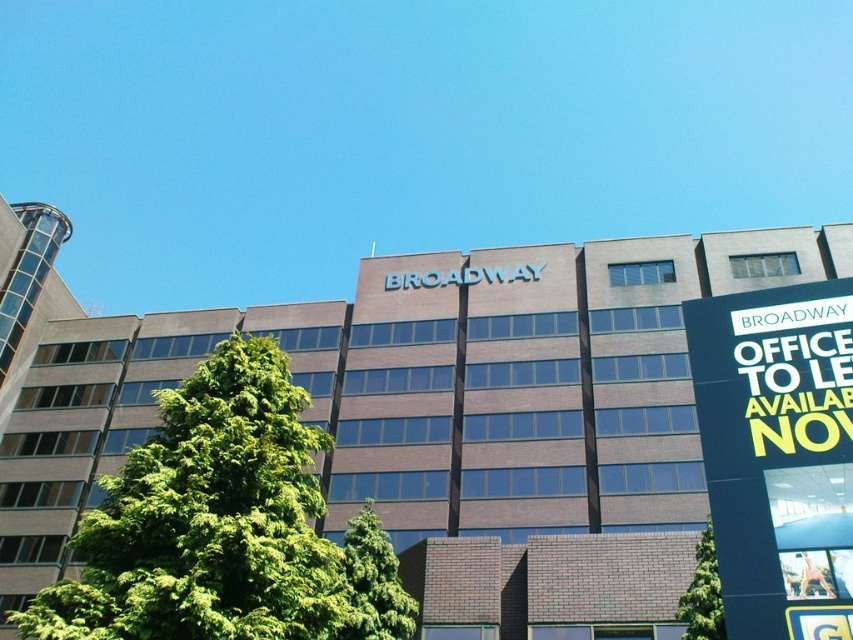
You are standing at the center of the image and want to find the green leafy tree at left. In which direction should you look?

The green leafy tree at left is located at point (224, 525), so you should look to the left side of the image.

You are a window installer who needs to determine if a new window can fit between the green leafy tree at left and the blue plastic signboard at upper right. The window is 1.5 meters wide. Can you fit the window in that space?

The green leafy tree at left might be wider than blue plastic signboard at upper right, so it is uncertain if the space between them is wide enough for a 1.5 meter window. Further measurement is required.